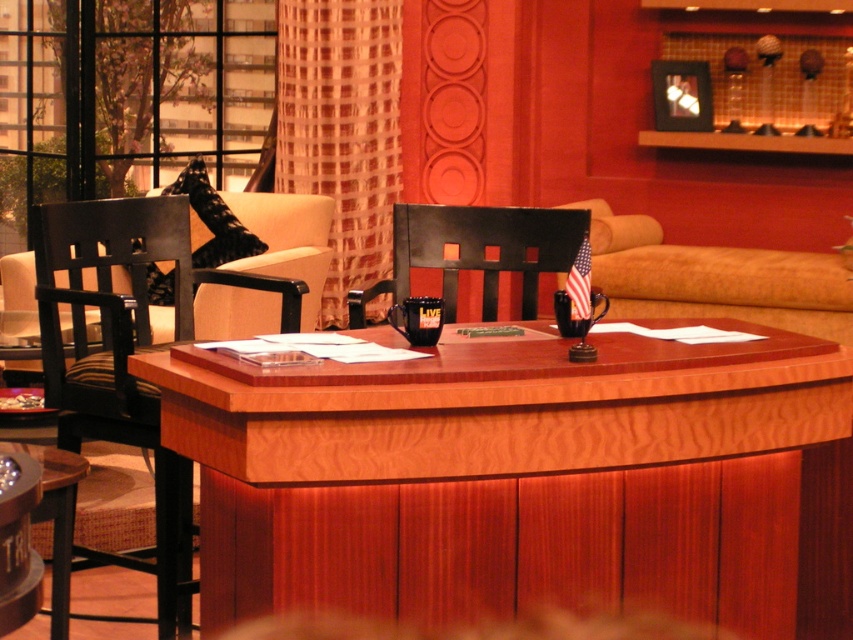
Is wooden desk at center thinner than wooden table at lower left?

No.

Which is more to the right, wooden desk at center or wooden table at lower left?

Positioned to the right is wooden desk at center.

Based on the photo, who is more distant from viewer, (289, 509) or (61, 593)?

The point (61, 593) is more distant.

This screenshot has width=853, height=640. I want to click on wooden desk at center, so point(519,476).

Who is positioned more to the right, wooden desk at center or black wood chair at left?

From the viewer's perspective, wooden desk at center appears more on the right side.

Can you confirm if wooden desk at center is positioned to the right of black wood chair at left?

Indeed, wooden desk at center is positioned on the right side of black wood chair at left.

The image size is (853, 640). Identify the location of wooden desk at center. (519, 476).

Locate an element on the screen. The image size is (853, 640). wooden desk at center is located at coordinates (519, 476).

Can you confirm if wooden desk at center is positioned below black leather chair at center?

Yes.

The width and height of the screenshot is (853, 640). Describe the element at coordinates (519, 476) in the screenshot. I see `wooden desk at center` at that location.

Measure the distance between point (782, 563) and camera.

They are 3.20 meters apart.

Locate an element on the screen. wooden desk at center is located at coordinates (519, 476).